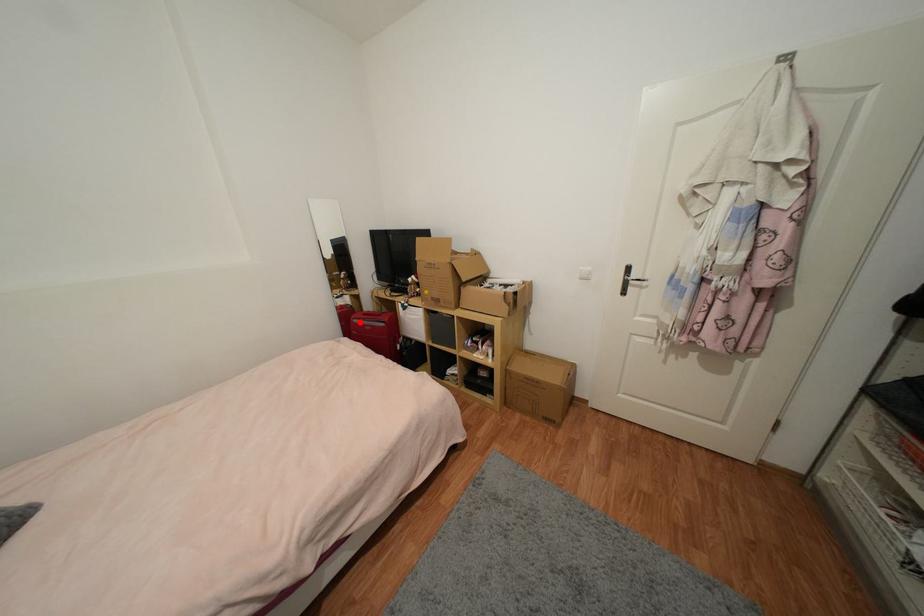
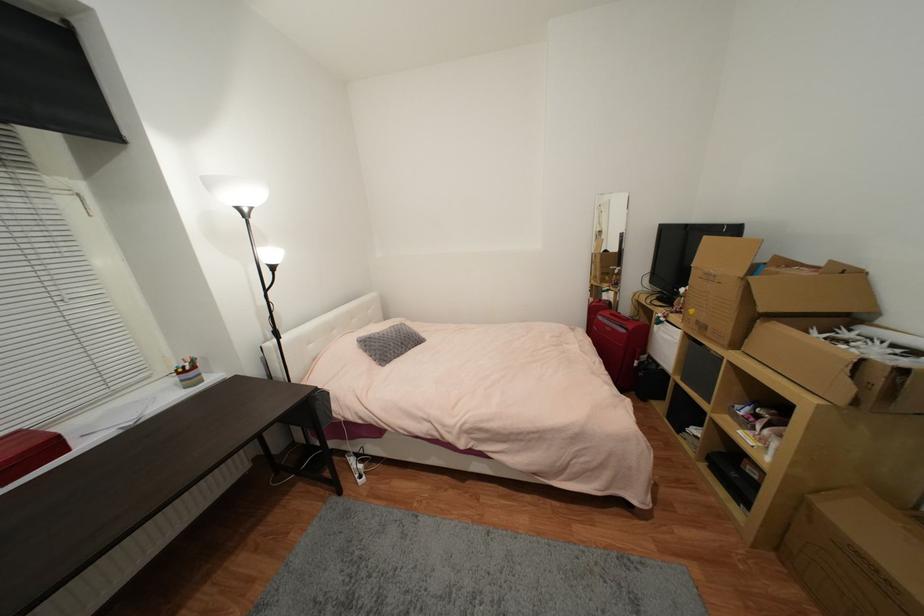
In the second image, find the point that corresponds to the highlighted location in the first image.

(603, 318)